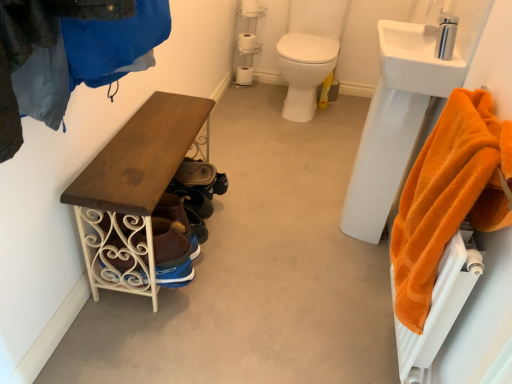
Where is `vacant area that lies between white plastic shelf at center and white glossy toilet at center`? The image size is (512, 384). vacant area that lies between white plastic shelf at center and white glossy toilet at center is located at coordinates (254, 92).